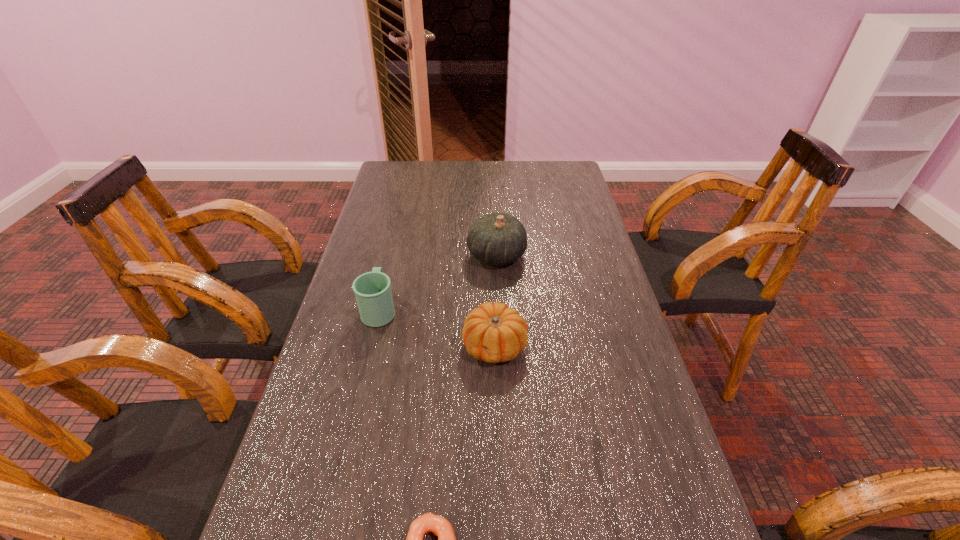
Where is `the taller gourd`? The height and width of the screenshot is (540, 960). the taller gourd is located at coordinates (498, 239).

Where is `the farther gourd`? The image size is (960, 540). the farther gourd is located at coordinates (498, 239).

The width and height of the screenshot is (960, 540). Find the location of `the leftmost object`. the leftmost object is located at coordinates (373, 293).

Identify the location of the nearer gourd. The height and width of the screenshot is (540, 960). point(493,332).

This screenshot has height=540, width=960. I want to click on the third tallest object, so click(493, 332).

You are a GUI agent. You are given a task and a screenshot of the screen. Output one action in this format:
    pyautogui.click(x=<x>, y=<y>)
    Task: Click on the free region located on the back of the tallest object
    The width and height of the screenshot is (960, 540).
    Given the screenshot: What is the action you would take?
    pyautogui.click(x=493, y=195)

Locate an element on the screen. This screenshot has height=540, width=960. vacant position located on the side of the leftmost object with the handle is located at coordinates (400, 225).

Locate an element on the screen. The height and width of the screenshot is (540, 960). vacant space situated on the side of the leftmost object with the handle is located at coordinates (397, 235).

Image resolution: width=960 pixels, height=540 pixels. I want to click on vacant region located 0.320m on the side of the leftmost object with the handle, so click(x=400, y=225).

In order to click on vacant space positioned 0.210m on the back of the second shortest object in this screenshot , I will do `click(492, 268)`.